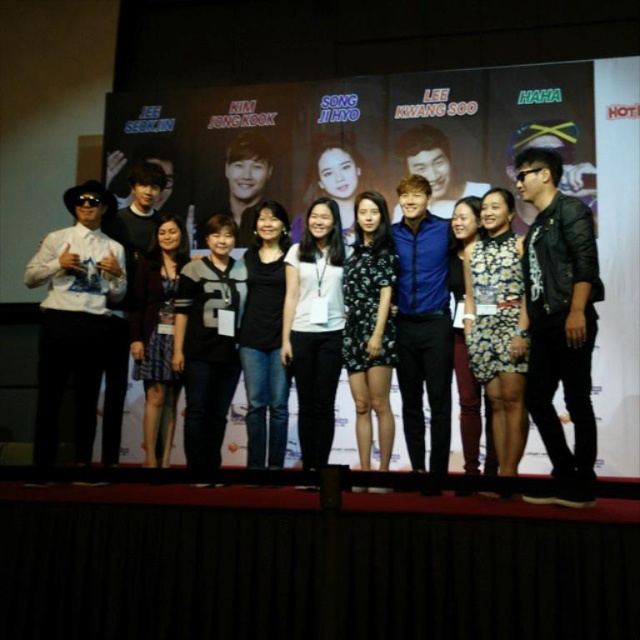
Question: Which of the following is the farthest from the observer?

Choices:
 (A) floral dress at center
 (B) floral-patterned dress at center

Answer: (B)

Question: Is blue smooth shirt at center thinner than black matte jeans at center?

Choices:
 (A) yes
 (B) no

Answer: (B)

Question: Does blue smooth shirt at center appear under floral dress at center?

Choices:
 (A) no
 (B) yes

Answer: (A)

Question: Is leather jacket at right bigger than floral dress at center?

Choices:
 (A) yes
 (B) no

Answer: (A)

Question: Which object is the farthest from the white matte shirt at left?

Choices:
 (A) leather jacket at right
 (B) white matte shirt at center

Answer: (A)

Question: Estimate the real-world distances between objects in this image. Which object is closer to the floral-patterned dress at center?

Choices:
 (A) white matte shirt at left
 (B) floral dress at center
 (C) plaid skirt at center

Answer: (B)